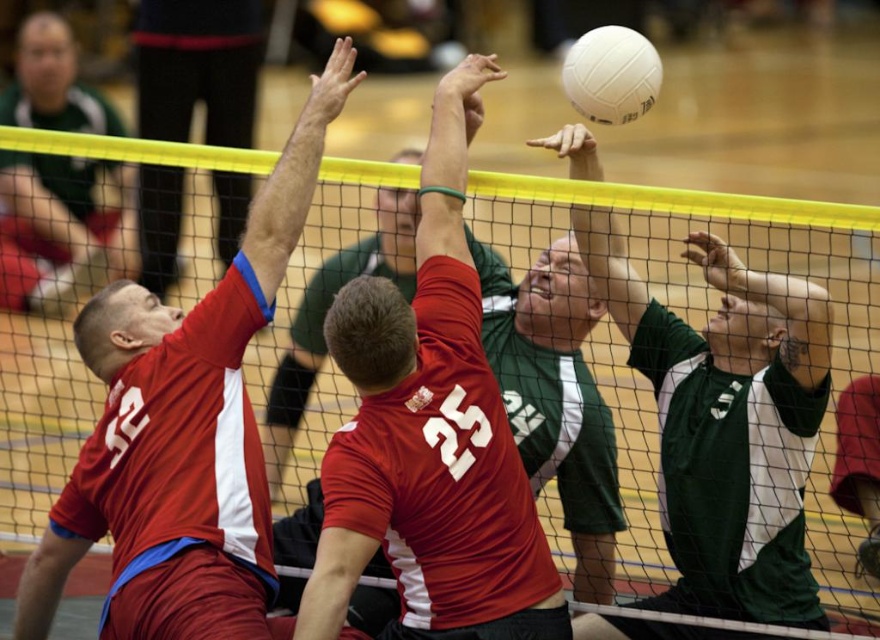
Where is the matte red jersey at center located in the image?

The matte red jersey at center is located at point 0.683 on the x axis and 0.490 on the y axis.

Consider the image. What are the coordinates of the matte red jersey at center?

The coordinates of the matte red jersey at center are at point (430, 436).